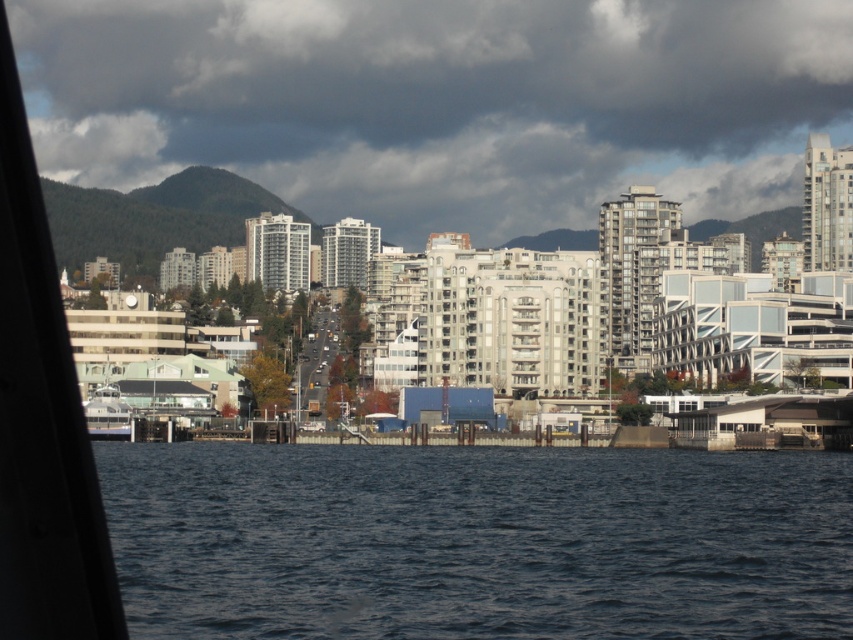
Question: Is dark gray cloud at upper center thinner than white glossy ferry at lower left?

Choices:
 (A) yes
 (B) no

Answer: (B)

Question: Is dark blue water at center below white glossy ferry at lower left?

Choices:
 (A) no
 (B) yes

Answer: (B)

Question: Estimate the real-world distances between objects in this image. Which object is closer to the white glossy ferry at lower left?

Choices:
 (A) dark blue water at center
 (B) dark gray cloud at upper center

Answer: (A)

Question: Does dark gray cloud at upper center have a greater width compared to dark blue water at center?

Choices:
 (A) yes
 (B) no

Answer: (A)

Question: Which point is farther to the camera?

Choices:
 (A) dark blue water at center
 (B) dark gray cloud at upper center

Answer: (B)

Question: Which object is farther from the camera taking this photo?

Choices:
 (A) dark blue water at center
 (B) white glossy ferry at lower left

Answer: (B)